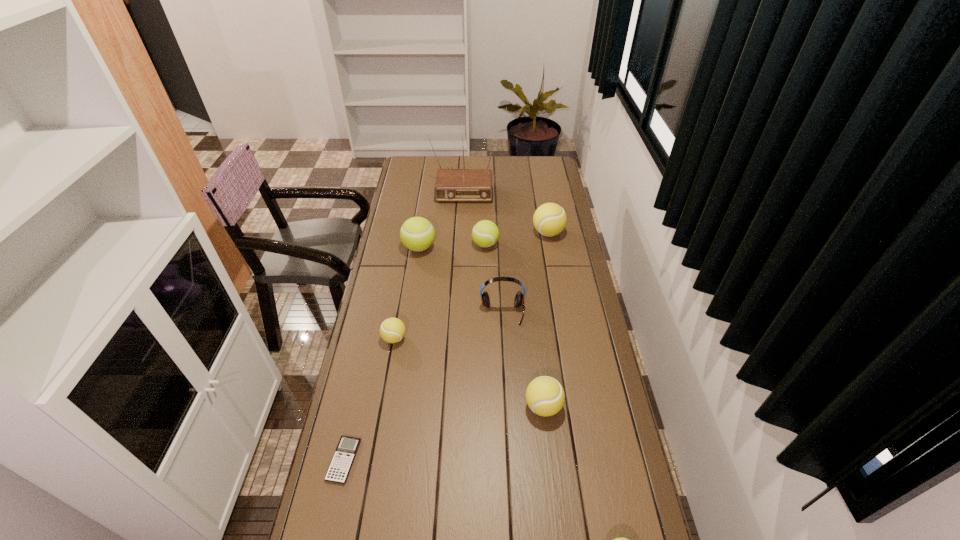
Where is `the smallest yellow tennis ball`? The width and height of the screenshot is (960, 540). the smallest yellow tennis ball is located at coordinates (392, 330).

The height and width of the screenshot is (540, 960). What are the coordinates of `the fourth nearest object` in the screenshot? It's located at (392, 330).

Where is `the shortest object`? the shortest object is located at coordinates (341, 463).

The height and width of the screenshot is (540, 960). In order to click on calculator in this screenshot , I will do `click(341, 463)`.

In order to click on free space located 0.330m on the front panel of the radio_receiver in this screenshot , I will do `click(460, 247)`.

In order to click on free spot located on the front of the biggest yellow tennis ball in this screenshot , I will do `click(561, 302)`.

At what (x,y) coordinates should I click in order to perform the action: click on vacant region located 0.380m on the front of the biggest green tennis ball. Please return your answer as a coordinate pair (x, y). The height and width of the screenshot is (540, 960). Looking at the image, I should click on (407, 327).

Image resolution: width=960 pixels, height=540 pixels. I want to click on free space located with the microphone attached to the side of the headset, so [504, 339].

I want to click on free spot located 0.230m on the left of the nearest yellow tennis ball, so click(451, 406).

The image size is (960, 540). In order to click on vacant space located 0.080m on the right of the second green tennis ball from right to left in this screenshot , I will do `click(516, 245)`.